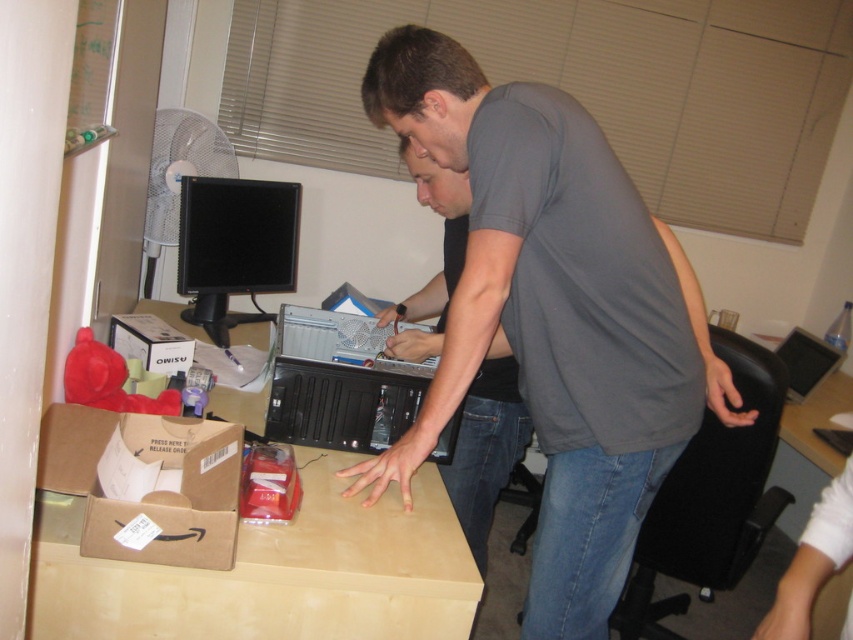
Question: Which object is farther from the camera taking this photo?

Choices:
 (A) black plastic desktop computer at center
 (B) gray cotton shirt at center
 (C) brown cardboard computer desk at center

Answer: (A)

Question: Among these points, which one is farthest from the camera?

Choices:
 (A) (289, 531)
 (B) (219, 244)
 (C) (144, 454)

Answer: (B)

Question: Which object is positioned farthest from the black plastic desktop computer at center?

Choices:
 (A) gray matte shirt at center
 (B) black glossy monitor at upper left
 (C) brown cardboard box at lower left

Answer: (B)

Question: Can you confirm if brown cardboard box at lower left is positioned to the left of black plastic desktop computer at center?

Choices:
 (A) yes
 (B) no

Answer: (A)

Question: Is gray matte shirt at center bigger than brown cardboard box at lower left?

Choices:
 (A) no
 (B) yes

Answer: (B)

Question: Does gray matte shirt at center have a larger size compared to brown cardboard computer desk at center?

Choices:
 (A) yes
 (B) no

Answer: (A)